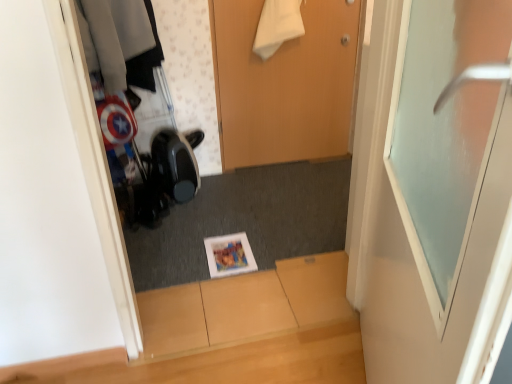
The image size is (512, 384). Describe the element at coordinates (438, 196) in the screenshot. I see `frosted glass door at upper right, which appears as the 2th door when viewed from the back` at that location.

This screenshot has width=512, height=384. In order to click on matte paper magazine at center in this screenshot , I will do `click(229, 255)`.

At what (x,y) coordinates should I click in order to perform the action: click on frosted glass door at upper right, the first door when ordered from front to back. Please return your answer as a coordinate pair (x, y). Looking at the image, I should click on pos(438,196).

Which object is positioned more to the left, wooden door at center, which is the first door in back-to-front order, or frosted glass door at upper right, the first door when ordered from front to back?

wooden door at center, which is the first door in back-to-front order.

Would you say wooden door at center, which is the first door in back-to-front order, is inside or outside frosted glass door at upper right, which appears as the 2th door when viewed from the back?

wooden door at center, which is the first door in back-to-front order, cannot be found inside frosted glass door at upper right, which appears as the 2th door when viewed from the back.

Which of these two, wooden door at center, the second door when ordered from front to back, or frosted glass door at upper right, which appears as the 2th door when viewed from the back, stands taller?

With more height is frosted glass door at upper right, which appears as the 2th door when viewed from the back.

Considering the sizes of frosted glass door at upper right, the first door when ordered from front to back, and matte paper magazine at center in the image, is frosted glass door at upper right, the first door when ordered from front to back, wider or thinner than matte paper magazine at center?

In the image, frosted glass door at upper right, the first door when ordered from front to back, appears to be more narrow than matte paper magazine at center.

Measure the distance from frosted glass door at upper right, the first door when ordered from front to back, to matte paper magazine at center.

frosted glass door at upper right, the first door when ordered from front to back, is 1.11 meters from matte paper magazine at center.

Is frosted glass door at upper right, which appears as the 2th door when viewed from the back, bigger or smaller than matte paper magazine at center?

In the image, frosted glass door at upper right, which appears as the 2th door when viewed from the back, appears to be larger than matte paper magazine at center.

Which is in front, point (230, 257) or point (258, 93)?

Point (230, 257)

Choose the correct answer: Is matte paper magazine at center inside wooden door at center, which is the first door in back-to-front order, or outside it?

matte paper magazine at center is spatially situated outside wooden door at center, which is the first door in back-to-front order.

From a real-world perspective, which object stands above the other?

wooden door at center, which is the first door in back-to-front order.

You are a GUI agent. You are given a task and a screenshot of the screen. Output one action in this format:
    pyautogui.click(x=<x>, y=<y>)
    Task: Click on the 1st door counting from the right side of the matte paper magazine at center
    
    Given the screenshot: What is the action you would take?
    pyautogui.click(x=284, y=84)

In order to click on door behind the frosted glass door at upper right, which appears as the 2th door when viewed from the back in this screenshot , I will do `click(284, 84)`.

In terms of width, does frosted glass door at upper right, the first door when ordered from front to back, look wider or thinner when compared to wooden door at center, which is the first door in back-to-front order?

Clearly, frosted glass door at upper right, the first door when ordered from front to back, has more width compared to wooden door at center, which is the first door in back-to-front order.

Considering the positions of points (494, 34) and (301, 125), is point (494, 34) farther from camera compared to point (301, 125)?

No, (494, 34) is in front of (301, 125).

From a real-world perspective, is frosted glass door at upper right, the first door when ordered from front to back, below wooden door at center, which is the first door in back-to-front order?

No.

Considering the sizes of wooden door at center, which is the first door in back-to-front order, and matte paper magazine at center in the image, is wooden door at center, which is the first door in back-to-front order, bigger or smaller than matte paper magazine at center?

wooden door at center, which is the first door in back-to-front order, is bigger than matte paper magazine at center.

In terms of height, does wooden door at center, which is the first door in back-to-front order, look taller or shorter compared to matte paper magazine at center?

Clearly, wooden door at center, which is the first door in back-to-front order, is taller compared to matte paper magazine at center.

In the image, is wooden door at center, the second door when ordered from front to back, positioned in front of or behind matte paper magazine at center?

wooden door at center, the second door when ordered from front to back, is positioned farther from the viewer than matte paper magazine at center.

Between point (354, 39) and point (222, 260), which one is positioned in front?

Point (222, 260)

Could you tell me if matte paper magazine at center is turned towards frosted glass door at upper right, the first door when ordered from front to back?

No, matte paper magazine at center is not aimed at frosted glass door at upper right, the first door when ordered from front to back.

From the image's perspective, would you say matte paper magazine at center is shown under frosted glass door at upper right, which appears as the 2th door when viewed from the back?

Yes, from the image's perspective, matte paper magazine at center is below frosted glass door at upper right, which appears as the 2th door when viewed from the back.

Which object is further away from the camera, matte paper magazine at center or frosted glass door at upper right, the first door when ordered from front to back?

matte paper magazine at center.

How different are the orientations of matte paper magazine at center and frosted glass door at upper right, which appears as the 2th door when viewed from the back, in degrees?

The facing directions of matte paper magazine at center and frosted glass door at upper right, which appears as the 2th door when viewed from the back, are 109 degrees apart.

Identify the location of door that is on the left side of frosted glass door at upper right, the first door when ordered from front to back. (284, 84).

Find the location of a particular element. door in front of the matte paper magazine at center is located at coordinates (438, 196).

Based on their spatial positions, is frosted glass door at upper right, which appears as the 2th door when viewed from the back, or matte paper magazine at center further from wooden door at center, the second door when ordered from front to back?

frosted glass door at upper right, which appears as the 2th door when viewed from the back.

When comparing their distances from matte paper magazine at center, does frosted glass door at upper right, the first door when ordered from front to back, or wooden door at center, the second door when ordered from front to back, seem further?

frosted glass door at upper right, the first door when ordered from front to back, is positioned further to the anchor matte paper magazine at center.

Based on their spatial positions, is matte paper magazine at center or wooden door at center, the second door when ordered from front to back, closer to frosted glass door at upper right, which appears as the 2th door when viewed from the back?

Among the two, matte paper magazine at center is located nearer to frosted glass door at upper right, which appears as the 2th door when viewed from the back.

Estimate the real-world distances between objects in this image. Which object is closer to matte paper magazine at center, wooden door at center, the second door when ordered from front to back, or frosted glass door at upper right, which appears as the 2th door when viewed from the back?

wooden door at center, the second door when ordered from front to back, is closer to matte paper magazine at center.

Estimate the real-world distances between objects in this image. Which object is closer to frosted glass door at upper right, the first door when ordered from front to back, wooden door at center, the second door when ordered from front to back, or matte paper magazine at center?

matte paper magazine at center is positioned closer to the anchor frosted glass door at upper right, the first door when ordered from front to back.

Which object lies further to the anchor point wooden door at center, which is the first door in back-to-front order, matte paper magazine at center or frosted glass door at upper right, which appears as the 2th door when viewed from the back?

Among the two, frosted glass door at upper right, which appears as the 2th door when viewed from the back, is located further to wooden door at center, which is the first door in back-to-front order.

Identify the location of magazine between frosted glass door at upper right, which appears as the 2th door when viewed from the back, and wooden door at center, which is the first door in back-to-front order, in the front-back direction. Image resolution: width=512 pixels, height=384 pixels. (229, 255).